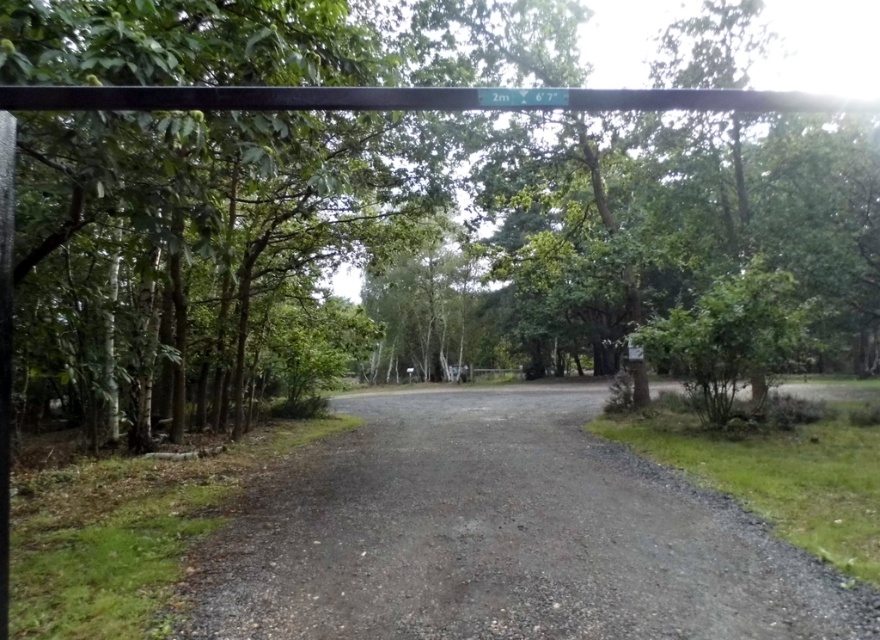
Does black metal pole at upper center appear over green plastic sign at upper center?

No, black metal pole at upper center is not above green plastic sign at upper center.

Image resolution: width=880 pixels, height=640 pixels. What do you see at coordinates (413, 99) in the screenshot?
I see `black metal pole at upper center` at bounding box center [413, 99].

Where is `black metal pole at upper center`? black metal pole at upper center is located at coordinates (413, 99).

Measure the distance between gray gravel driveway at center and black metal pole at upper center.

gray gravel driveway at center is 12.36 feet from black metal pole at upper center.

Between gray gravel driveway at center and black metal pole at upper center, which one appears on the right side from the viewer's perspective?

gray gravel driveway at center is more to the right.

Measure the distance between point (x=412, y=570) and camera.

A distance of 10.02 feet exists between point (x=412, y=570) and camera.

Where is `gray gravel driveway at center`? The height and width of the screenshot is (640, 880). gray gravel driveway at center is located at coordinates (502, 536).

Which is in front, point (0, 150) or point (350, 106)?

Positioned in front is point (350, 106).

This screenshot has height=640, width=880. Identify the location of green leafy tree at upper center. (238, 97).

Where is `green leafy tree at upper center`? green leafy tree at upper center is located at coordinates (238, 97).